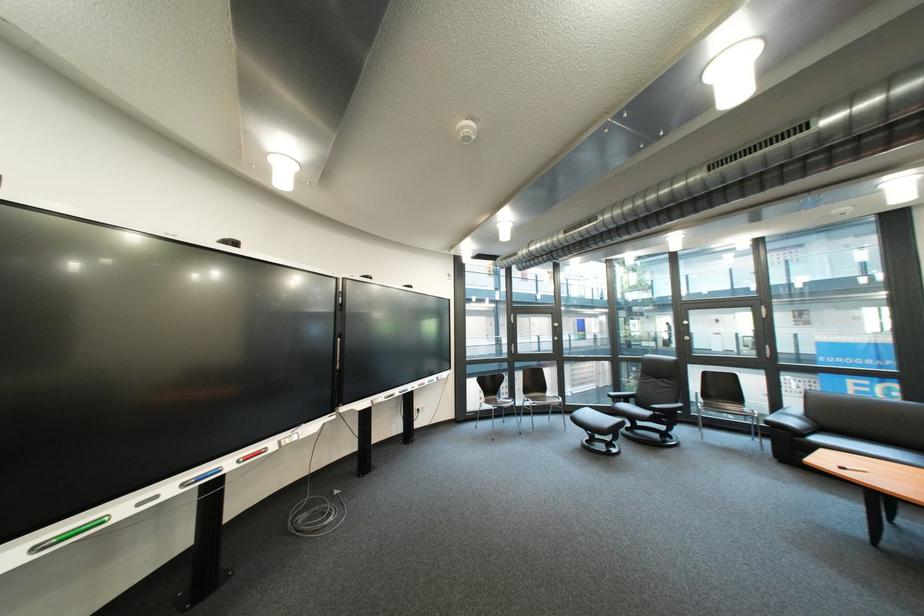
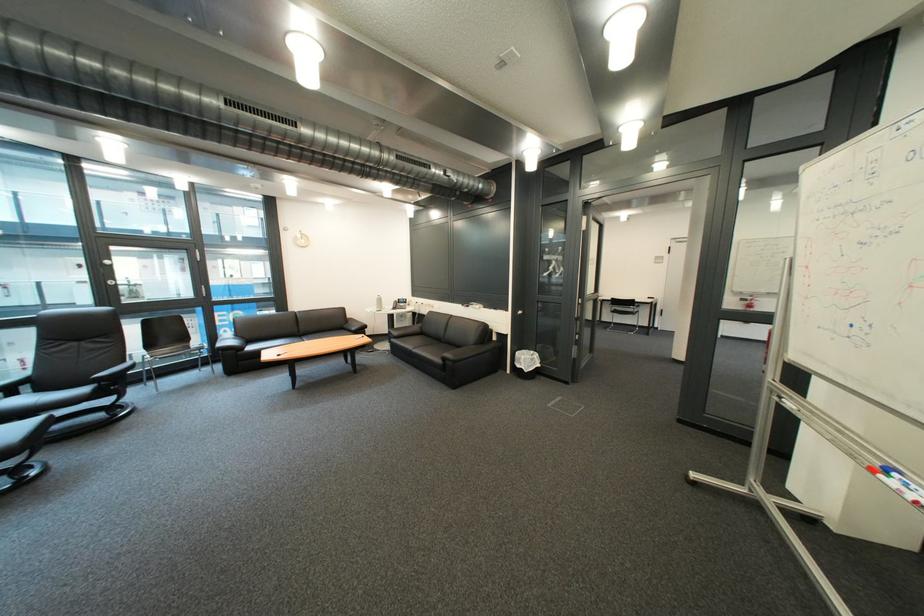
In the second image, find the point that corresponds to point 636,400 in the first image.

(16, 395)